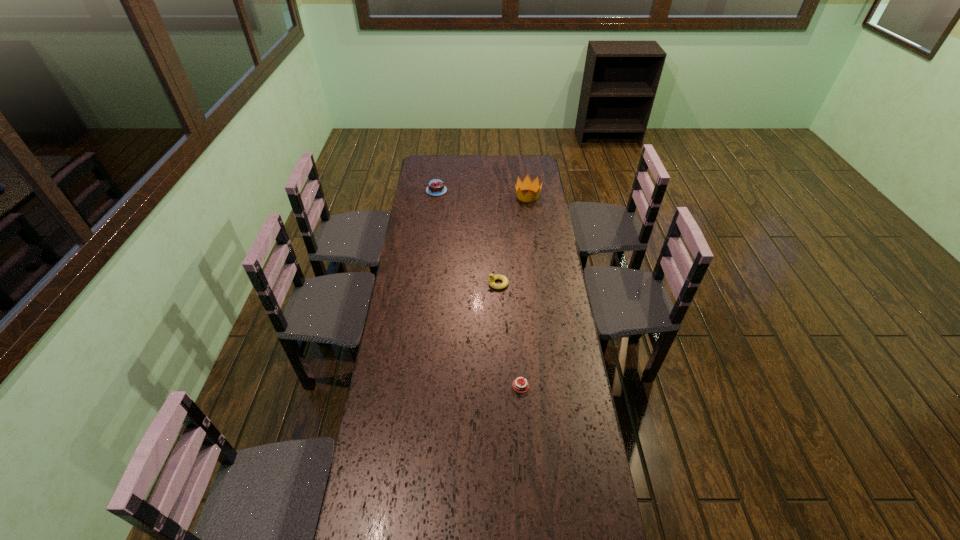
This screenshot has width=960, height=540. I want to click on free space located 0.230m on the face of the duckling, so click(x=435, y=284).

Where is `free spot located 0.310m on the left of the right chocolate cake`? The height and width of the screenshot is (540, 960). free spot located 0.310m on the left of the right chocolate cake is located at coordinates (418, 386).

Identify the location of object that is at the left edge. The height and width of the screenshot is (540, 960). (435, 187).

Image resolution: width=960 pixels, height=540 pixels. What are the coordinates of `crown located at the right edge` in the screenshot? It's located at (534, 186).

Locate an element on the screen. Image resolution: width=960 pixels, height=540 pixels. chocolate cake located in the right edge section of the desktop is located at coordinates (518, 385).

The height and width of the screenshot is (540, 960). In the image, there is a desktop. Identify the location of blank space at the left edge. (420, 232).

The height and width of the screenshot is (540, 960). Find the location of `vacant region at the right edge of the desktop`. vacant region at the right edge of the desktop is located at coordinates (527, 193).

In the image, there is a desktop. Where is `free space at the far left corner`? This screenshot has width=960, height=540. free space at the far left corner is located at coordinates (444, 170).

At what (x,y) coordinates should I click in order to perform the action: click on free space at the far right corner. Please return your answer as a coordinate pair (x, y). Image resolution: width=960 pixels, height=540 pixels. Looking at the image, I should click on (537, 172).

This screenshot has width=960, height=540. Find the location of `unoccupied area between the leftmost object and the tallest object`. unoccupied area between the leftmost object and the tallest object is located at coordinates (482, 193).